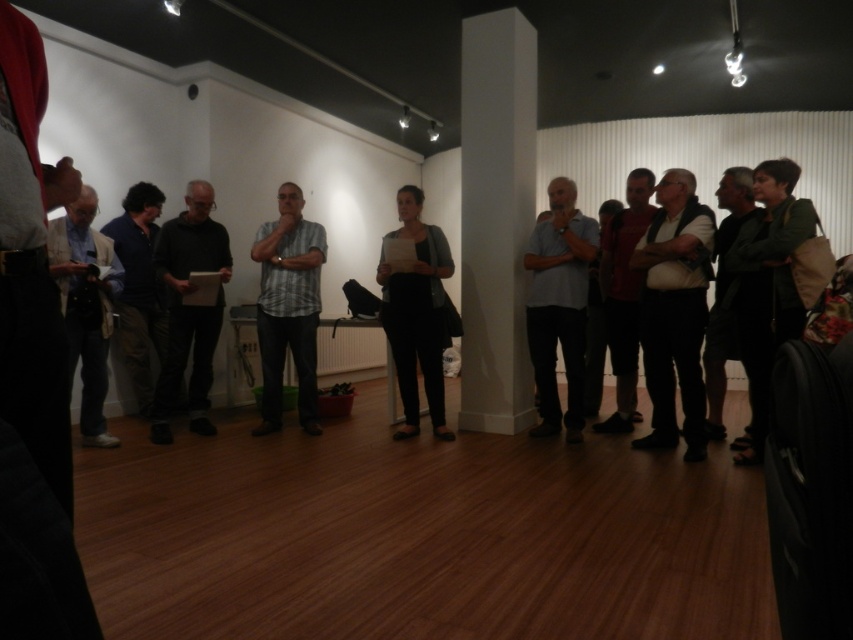
You are an event planner trying to arrange seating for a presentation in the gallery. You notice a person wearing a black matte shirt at center and a matte black pants at center. Which clothing item is closer to the front of the room?

The black matte shirt at center is in front of the matte black pants at center, so the black matte shirt at center is closer to the front of the room.

Where is the striped cotton shirt at center located in the image?

The striped cotton shirt at center is located at point (288, 307).

You are standing in the gallery and want to move from the point closer to you to the point further away. Which path should you take to go from point [175,259] to point [618,420]?

The path from point [175,259] to point [618,420] requires moving towards the upper right direction since point [175,259] is closer to the viewer and point [618,420] is further away.